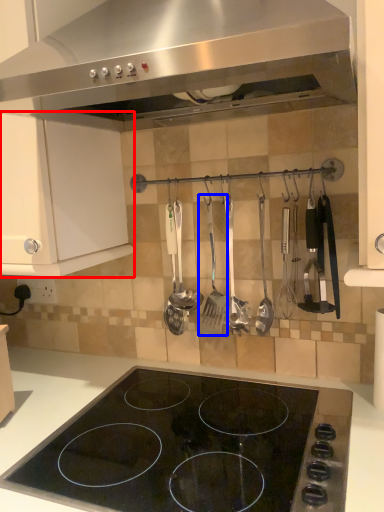
Question: Which object appears closest to the camera in this image, cabinetry (highlighted by a red box) or silverware (highlighted by a blue box)?

Choices:
 (A) cabinetry
 (B) silverware

Answer: (A)